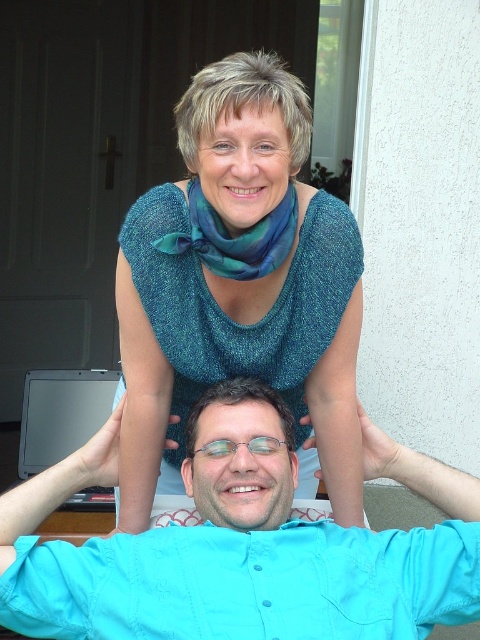
Question: Which of the following is the farthest from the observer?

Choices:
 (A) clear plastic glasses at center
 (B) teal silk scarf at upper center

Answer: (A)

Question: Can you confirm if teal shimmering blouse at upper center is positioned to the left of blue cotton shirt at center?

Choices:
 (A) yes
 (B) no

Answer: (A)

Question: Can you confirm if blue cotton shirt at center is positioned to the right of teal silk scarf at upper center?

Choices:
 (A) no
 (B) yes

Answer: (B)

Question: Which of the following is the closest to the observer?

Choices:
 (A) blue cotton shirt at center
 (B) teal silk scarf at upper center
 (C) teal shimmering blouse at upper center
 (D) clear plastic glasses at center

Answer: (A)

Question: Which point is closer to the camera?

Choices:
 (A) teal silk scarf at upper center
 (B) clear plastic glasses at center
 (C) teal shimmering blouse at upper center

Answer: (C)

Question: Where is blue cotton shirt at center located in relation to teal silk scarf at upper center in the image?

Choices:
 (A) below
 (B) above

Answer: (A)